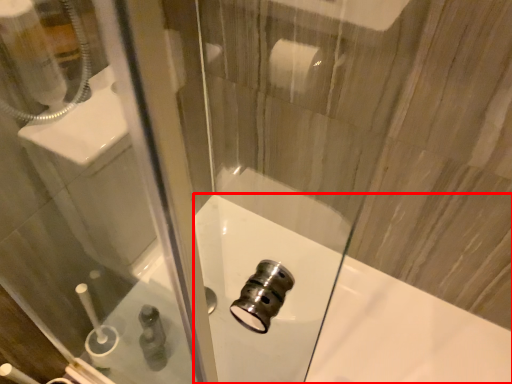
Question: Observing the image, what is the correct spatial positioning of bath (annotated by the red box) in reference to toiletry?

Choices:
 (A) right
 (B) left

Answer: (A)